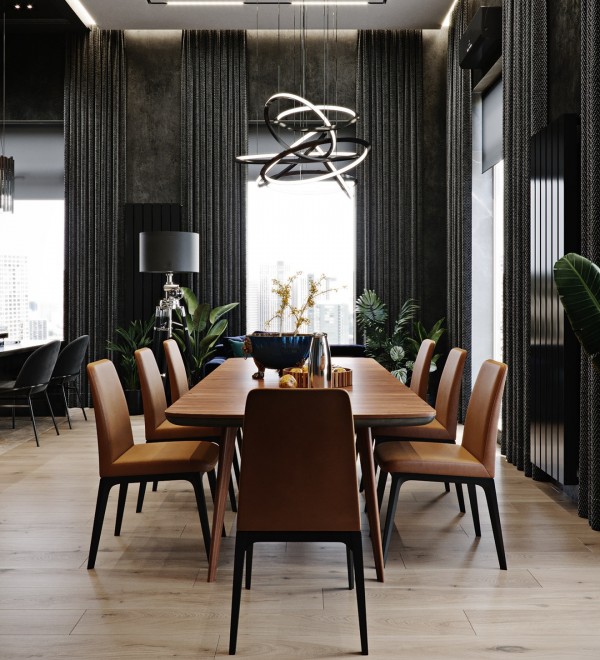
Pinpoint the coordinates of where to sit on in the image. Your answer should be formatted as a list of tuples, i.e. [(x1, y1), (x2, y2), ...], where each tuple contains the x and y coordinates of a point satisfying the conditions above.

[(446, 446), (163, 449)]